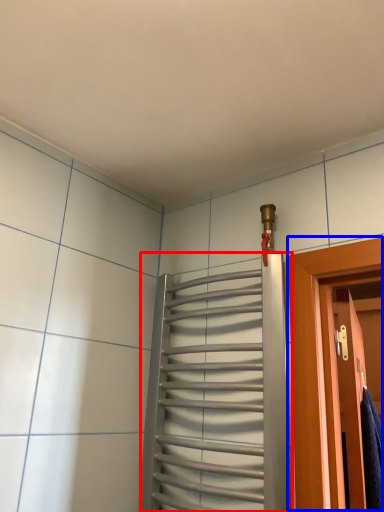
Question: Which point is closer to the camera, elevator (highlighted by a red box) or door (highlighted by a blue box)?

Choices:
 (A) elevator
 (B) door

Answer: (A)